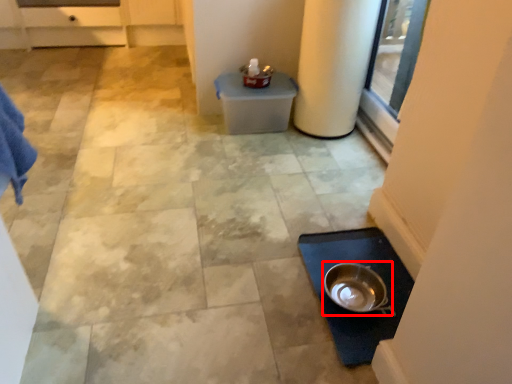
Question: From the image's perspective, what is the correct spatial positioning of mixing bowl (annotated by the red box) in reference to pillar?

Choices:
 (A) above
 (B) below

Answer: (B)